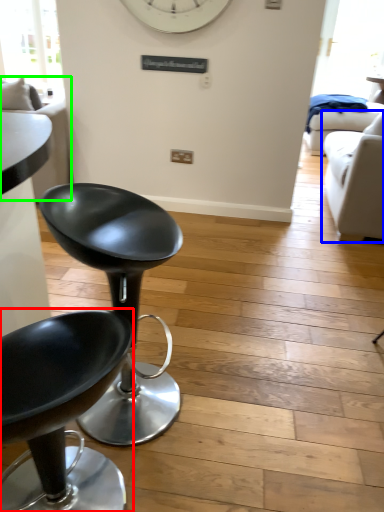
Question: Which object is the farthest from chair (highlighted by a red box)? Choose among these: studio couch (highlighted by a blue box) or couch (highlighted by a green box).

Choices:
 (A) studio couch
 (B) couch

Answer: (A)